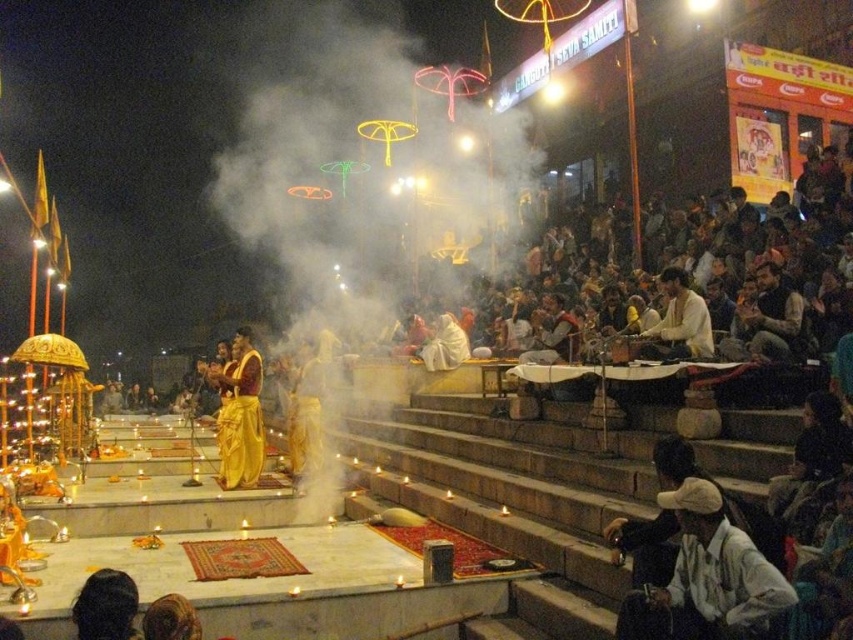
You are a photographer trying to capture the scene from a distance of 100 meters away. You notice both the white smoke at center and the white cotton shirt at center. Which object would appear larger in your photo?

The white cotton shirt at center would appear larger in the photo because it is closer to the photographer than the white smoke at center, which is farther away by 97.61 meters.

You are a photographer standing at the edge of the stone platform. You want to capture a photo of the golden silk sari at center and the white cotton cap at lower right in the same frame. Given that your camera has a maximum zoom range of 50 meters, can you fit both objects into the frame without moving closer?

The white cotton cap at lower right is 56.67 meters away from the golden silk sari at center. Since the distance between them exceeds the camera maximum zoom range of 50 meters, you cannot fit both objects into the frame without moving closer.

You are attending a nighttime religious event by the riverside and notice a white cotton cap at lower right. Where exactly is the white cotton cap located in relation to the ceremonial area?

The white cotton cap at lower right is located at point 0.881 on the horizontal axis and 0.845 on the vertical axis relative to the ceremonial area.